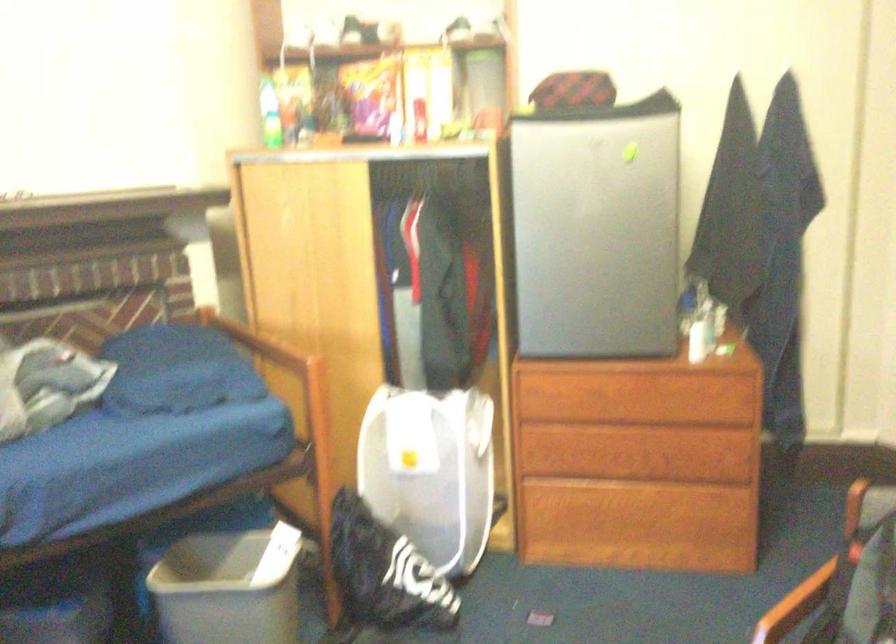
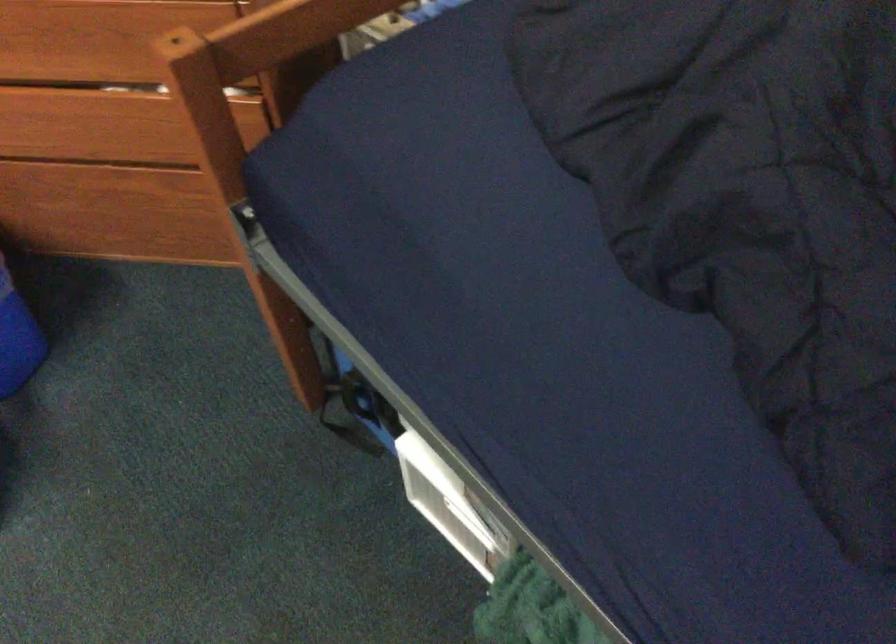
First-person continuous shooting, in which direction is the camera rotating?

The rotation direction of the camera is right-down.